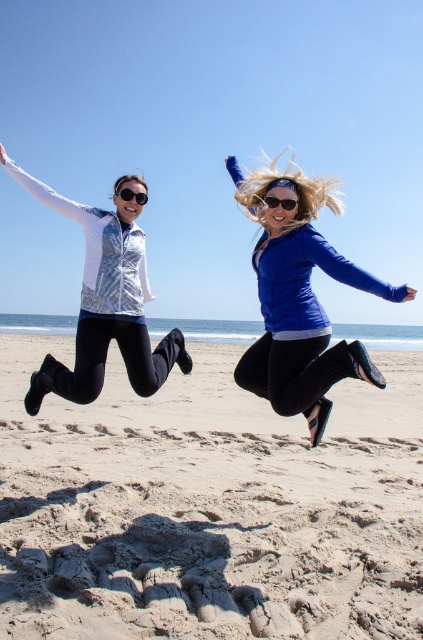
Question: Is the position of blue matte jacket at upper right less distant than that of transparent plastic goggles at center?

Choices:
 (A) yes
 (B) no

Answer: (A)

Question: Which point is closer to the camera taking this photo?

Choices:
 (A) (134, 305)
 (B) (247, 588)

Answer: (B)

Question: Which is nearer to the transparent plastic goggles at center?

Choices:
 (A) black plastic goggles at upper center
 (B) sandy beach at lower center

Answer: (A)

Question: Which point appears farthest from the camera in this image?

Choices:
 (A) (268, 202)
 (B) (93, 348)
 (C) (282, 612)

Answer: (B)

Question: Is sandy beach at lower center positioned in front of transparent plastic goggles at center?

Choices:
 (A) yes
 (B) no

Answer: (A)

Question: Does transparent plastic goggles at center appear under black plastic goggles at upper center?

Choices:
 (A) yes
 (B) no

Answer: (A)